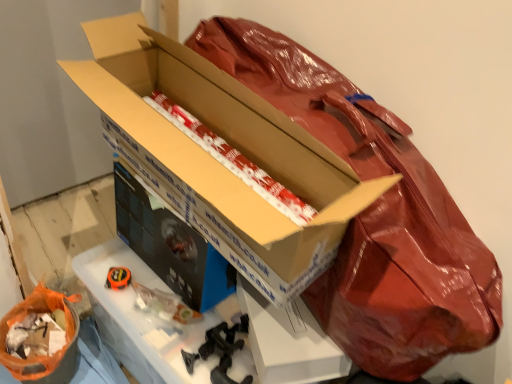
At what (x,y) coordinates should I click in order to perform the action: click on cardboard box at center, which is counted as the 2th box, starting from the back. Please return your answer as a coordinate pair (x, y). This screenshot has height=384, width=512. Looking at the image, I should click on (218, 161).

Where is `matte cardboard box at center, the first box positioned from the back`? This screenshot has width=512, height=384. matte cardboard box at center, the first box positioned from the back is located at coordinates (170, 245).

The width and height of the screenshot is (512, 384). I want to click on orange plastic bag at lower left, the first wrapping paper in the bottom-to-top sequence, so click(x=42, y=356).

Is point (216, 136) closer or farther from the camera than point (78, 317)?

Point (216, 136).

From the picture: Are white/red striped paper at center, the second wrapping paper ordered from the bottom, and orange plastic bag at lower left, the 2th wrapping paper in the right-to-left sequence, far apart?

They are positioned close to each other.

Could you tell me if white/red striped paper at center, the 2th wrapping paper when ordered from left to right, is facing orange plastic bag at lower left, arranged as the second wrapping paper when viewed from the top?

No, white/red striped paper at center, the 2th wrapping paper when ordered from left to right, is not turned towards orange plastic bag at lower left, arranged as the second wrapping paper when viewed from the top.

Does white/red striped paper at center, the 1th wrapping paper positioned from the right, have a greater width compared to orange plastic bag at lower left, the first wrapping paper positioned from the left?

Correct, the width of white/red striped paper at center, the 1th wrapping paper positioned from the right, exceeds that of orange plastic bag at lower left, the first wrapping paper positioned from the left.

What's the angular difference between white/red striped paper at center, the second wrapping paper ordered from the bottom, and matte cardboard box at center, the first box positioned from the back,'s facing directions?

85.2 degrees.

Is white/red striped paper at center, the second wrapping paper ordered from the bottom, wider or thinner than matte cardboard box at center, arranged as the 2th box when viewed from the front?

In the image, white/red striped paper at center, the second wrapping paper ordered from the bottom, appears to be wider than matte cardboard box at center, arranged as the 2th box when viewed from the front.

Which is less distant, (211, 141) or (201, 246)?

Point (211, 141) is farther from the camera than point (201, 246).

Which object is closer to the camera taking this photo, white/red striped paper at center, the 1th wrapping paper in the top-to-bottom sequence, or matte cardboard box at center, arranged as the 2th box when viewed from the front?

white/red striped paper at center, the 1th wrapping paper in the top-to-bottom sequence, is in front.

Is white/red striped paper at center, the second wrapping paper ordered from the bottom, not inside cardboard box at center, the 1th box when ordered from front to back?

No.

Can you confirm if white/red striped paper at center, the 2th wrapping paper when ordered from left to right, is taller than cardboard box at center, the 1th box when ordered from front to back?

No, white/red striped paper at center, the 2th wrapping paper when ordered from left to right, is not taller than cardboard box at center, the 1th box when ordered from front to back.

From a real-world perspective, between white/red striped paper at center, the 2th wrapping paper when ordered from left to right, and cardboard box at center, which is counted as the 2th box, starting from the back, who is vertically lower?

white/red striped paper at center, the 2th wrapping paper when ordered from left to right.

From the image's perspective, would you say white/red striped paper at center, the 1th wrapping paper positioned from the right, is positioned over cardboard box at center, the 1th box when ordered from front to back?

Yes, from the image's perspective, white/red striped paper at center, the 1th wrapping paper positioned from the right, is above cardboard box at center, the 1th box when ordered from front to back.

Is point (42, 295) behind point (199, 257)?

Yes.

Does orange plastic bag at lower left, the 2th wrapping paper in the right-to-left sequence, have a greater height compared to matte cardboard box at center, arranged as the 2th box when viewed from the front?

No, orange plastic bag at lower left, the 2th wrapping paper in the right-to-left sequence, is not taller than matte cardboard box at center, arranged as the 2th box when viewed from the front.

Is orange plastic bag at lower left, the 2th wrapping paper in the right-to-left sequence, further to camera compared to matte cardboard box at center, arranged as the 2th box when viewed from the front?

Yes.

Is orange plastic bag at lower left, arranged as the second wrapping paper when viewed from the top, positioned beyond the bounds of matte cardboard box at center, the first box positioned from the back?

orange plastic bag at lower left, arranged as the second wrapping paper when viewed from the top, is positioned outside matte cardboard box at center, the first box positioned from the back.

Are orange plastic bag at lower left, arranged as the second wrapping paper when viewed from the top, and white/red striped paper at center, the 1th wrapping paper positioned from the right, located far from each other?

No, orange plastic bag at lower left, arranged as the second wrapping paper when viewed from the top, is not far from white/red striped paper at center, the 1th wrapping paper positioned from the right.

Is orange plastic bag at lower left, the first wrapping paper positioned from the left, inside or outside of white/red striped paper at center, the 1th wrapping paper in the top-to-bottom sequence?

orange plastic bag at lower left, the first wrapping paper positioned from the left, is not inside white/red striped paper at center, the 1th wrapping paper in the top-to-bottom sequence, it's outside.

You are a GUI agent. You are given a task and a screenshot of the screen. Output one action in this format:
    pyautogui.click(x=<x>, y=<y>)
    Task: Click on the wrapping paper located underneath the white/red striped paper at center, the 2th wrapping paper when ordered from left to right (from a real-world perspective)
    This screenshot has height=384, width=512.
    Given the screenshot: What is the action you would take?
    pyautogui.click(x=42, y=356)

Considering the sizes of orange plastic bag at lower left, arranged as the second wrapping paper when viewed from the top, and white/red striped paper at center, the 1th wrapping paper positioned from the right, in the image, is orange plastic bag at lower left, arranged as the second wrapping paper when viewed from the top, taller or shorter than white/red striped paper at center, the 1th wrapping paper positioned from the right,?

In the image, orange plastic bag at lower left, arranged as the second wrapping paper when viewed from the top, appears to be taller than white/red striped paper at center, the 1th wrapping paper positioned from the right.

From a real-world perspective, is orange plastic bag at lower left, the first wrapping paper positioned from the left, above or below black cardboard workbench at center?

In terms of real-world spatial position, orange plastic bag at lower left, the first wrapping paper positioned from the left, is below black cardboard workbench at center.

Looking at their sizes, would you say orange plastic bag at lower left, arranged as the second wrapping paper when viewed from the top, is wider or thinner than black cardboard workbench at center?

orange plastic bag at lower left, arranged as the second wrapping paper when viewed from the top, is thinner than black cardboard workbench at center.

Looking at this image, considering the relative positions of orange plastic bag at lower left, the first wrapping paper in the bottom-to-top sequence, and black cardboard workbench at center in the image provided, is orange plastic bag at lower left, the first wrapping paper in the bottom-to-top sequence, to the left or to the right of black cardboard workbench at center?

Based on their positions, orange plastic bag at lower left, the first wrapping paper in the bottom-to-top sequence, is located to the left of black cardboard workbench at center.

What's the angular difference between orange plastic bag at lower left, the first wrapping paper positioned from the left, and black cardboard workbench at center's facing directions?

The angular difference between orange plastic bag at lower left, the first wrapping paper positioned from the left, and black cardboard workbench at center is 0.405 degrees.

What are the coordinates of `box behind the white/red striped paper at center, the 1th wrapping paper in the top-to-bottom sequence` in the screenshot? It's located at (170, 245).

Can you see matte cardboard box at center, the first box positioned from the back, touching white/red striped paper at center, the 2th wrapping paper when ordered from left to right?

They are not placed beside each other.

Considering the positions of objects matte cardboard box at center, arranged as the 2th box when viewed from the front, and white/red striped paper at center, the 2th wrapping paper when ordered from left to right, in the image provided, who is more to the right, matte cardboard box at center, arranged as the 2th box when viewed from the front, or white/red striped paper at center, the 2th wrapping paper when ordered from left to right,?

white/red striped paper at center, the 2th wrapping paper when ordered from left to right.

Is white/red striped paper at center, the 2th wrapping paper when ordered from left to right, located within matte cardboard box at center, the first box positioned from the back?

Definitely not — white/red striped paper at center, the 2th wrapping paper when ordered from left to right, is not inside matte cardboard box at center, the first box positioned from the back.

The height and width of the screenshot is (384, 512). What are the coordinates of `wrapping paper in front of the orange plastic bag at lower left, the first wrapping paper positioned from the left` in the screenshot? It's located at (233, 160).

Locate an element on the screen. box that appears below the white/red striped paper at center, the 1th wrapping paper positioned from the right (from a real-world perspective) is located at coordinates (170, 245).

Estimate the real-world distances between objects in this image. Which object is closer to matte cardboard box at center, arranged as the 2th box when viewed from the front, black cardboard workbench at center or white/red striped paper at center, the 2th wrapping paper when ordered from left to right?

The object closer to matte cardboard box at center, arranged as the 2th box when viewed from the front, is black cardboard workbench at center.

From the image, which object appears to be farther from white/red striped paper at center, the 1th wrapping paper positioned from the right, orange plastic bag at lower left, the first wrapping paper positioned from the left, or black cardboard workbench at center?

Based on the image, orange plastic bag at lower left, the first wrapping paper positioned from the left, appears to be further to white/red striped paper at center, the 1th wrapping paper positioned from the right.

Based on their spatial positions, is matte cardboard box at center, the first box positioned from the back, or orange plastic bag at lower left, the first wrapping paper positioned from the left, further from white/red striped paper at center, the 1th wrapping paper positioned from the right?

orange plastic bag at lower left, the first wrapping paper positioned from the left, is positioned further to the anchor white/red striped paper at center, the 1th wrapping paper positioned from the right.

When comparing their distances from orange plastic bag at lower left, the 2th wrapping paper in the right-to-left sequence, does matte cardboard box at center, arranged as the 2th box when viewed from the front, or black cardboard workbench at center seem further?

matte cardboard box at center, arranged as the 2th box when viewed from the front.

From the image, which object appears to be nearer to cardboard box at center, which is counted as the 2th box, starting from the back, white/red striped paper at center, the second wrapping paper ordered from the bottom, or black cardboard workbench at center?

white/red striped paper at center, the second wrapping paper ordered from the bottom, lies closer to cardboard box at center, which is counted as the 2th box, starting from the back, than the other object.

From the image, which object appears to be nearer to orange plastic bag at lower left, arranged as the second wrapping paper when viewed from the top, black cardboard workbench at center or white/red striped paper at center, the 1th wrapping paper in the top-to-bottom sequence?

black cardboard workbench at center is positioned closer to the anchor orange plastic bag at lower left, arranged as the second wrapping paper when viewed from the top.

From the image, which object appears to be nearer to cardboard box at center, the 1th box when ordered from front to back, orange plastic bag at lower left, the first wrapping paper in the bottom-to-top sequence, or matte cardboard box at center, the first box positioned from the back?

matte cardboard box at center, the first box positioned from the back, lies closer to cardboard box at center, the 1th box when ordered from front to back, than the other object.

Based on their spatial positions, is matte cardboard box at center, arranged as the 2th box when viewed from the front, or orange plastic bag at lower left, arranged as the second wrapping paper when viewed from the top, further from cardboard box at center, which is counted as the 2th box, starting from the back?

orange plastic bag at lower left, arranged as the second wrapping paper when viewed from the top.

Image resolution: width=512 pixels, height=384 pixels. I want to click on workbench between orange plastic bag at lower left, the 2th wrapping paper in the right-to-left sequence, and matte cardboard box at center, arranged as the 2th box when viewed from the front, so click(x=212, y=325).

This screenshot has width=512, height=384. In order to click on box positioned between cardboard box at center, which is counted as the 2th box, starting from the back, and orange plastic bag at lower left, arranged as the second wrapping paper when viewed from the top, from near to far in this screenshot , I will do `click(170, 245)`.

Identify the location of box that lies between cardboard box at center, which is counted as the 2th box, starting from the back, and black cardboard workbench at center from top to bottom. (170, 245).

I want to click on workbench between cardboard box at center, the 1th box when ordered from front to back, and orange plastic bag at lower left, the first wrapping paper in the bottom-to-top sequence, in the vertical direction, so click(x=212, y=325).